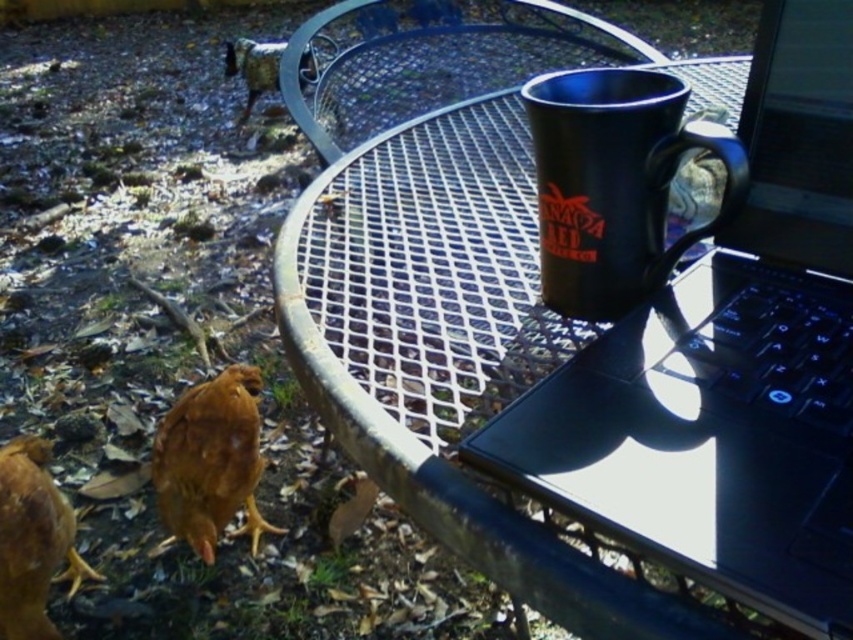
You are setting up a small picnic in your backyard and have a metallic mesh table at center and a black matte mug at upper center. Which object is wider?

The metallic mesh table at center is wider than the black matte mug at upper center.

You are standing at the edge of the round metal table and want to place an object exactly at the point with coordinates point (575,388). Is this point located on the metallic mesh table at center?

Yes, the point (575,388) is on the metallic mesh table at center, so placing the object there would be on the table.